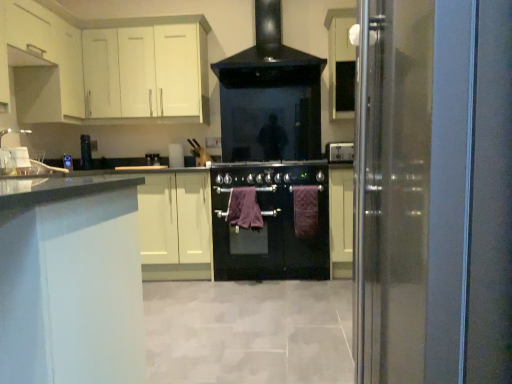
Question: Can you confirm if satin silver power outlet at upper right, acting as the 1th appliance starting from the right, is smaller than white matte cabinet at upper left, which is the second cabinetry in right-to-left order?

Choices:
 (A) no
 (B) yes

Answer: (B)

Question: Are satin silver power outlet at upper right, placed as the 2th appliance when sorted from left to right, and white matte cabinet at upper left, the first cabinetry in the left-to-right sequence, located far from each other?

Choices:
 (A) no
 (B) yes

Answer: (B)

Question: Is satin silver power outlet at upper right, acting as the first appliance starting from the front, next to white matte cabinet at upper left, which is the second cabinetry in back-to-front order?

Choices:
 (A) no
 (B) yes

Answer: (A)

Question: Considering the relative sizes of satin silver power outlet at upper right, acting as the 1th appliance starting from the right, and white matte cabinet at upper left, arranged as the first cabinetry when viewed from the front, in the image provided, is satin silver power outlet at upper right, acting as the 1th appliance starting from the right, wider than white matte cabinet at upper left, arranged as the first cabinetry when viewed from the front,?

Choices:
 (A) yes
 (B) no

Answer: (B)

Question: Is white matte cabinet at upper left, arranged as the first cabinetry when viewed from the front, a part of satin silver power outlet at upper right, acting as the first appliance starting from the front?

Choices:
 (A) no
 (B) yes

Answer: (A)

Question: From the image's perspective, relative to purple fabric towel at center, arranged as the second blanket when viewed from the left, is satin silver power outlet at upper right, placed as the 2th appliance when sorted from left to right, above or below?

Choices:
 (A) below
 (B) above

Answer: (B)

Question: Visually, is satin silver power outlet at upper right, acting as the 1th appliance starting from the right, positioned to the left or to the right of purple fabric towel at center, the first blanket when ordered from right to left?

Choices:
 (A) right
 (B) left

Answer: (A)

Question: Is point (352, 150) positioned closer to the camera than point (316, 205)?

Choices:
 (A) closer
 (B) farther

Answer: (B)

Question: Considering the positions of satin silver power outlet at upper right, acting as the first appliance starting from the front, and purple fabric towel at center, arranged as the second blanket when viewed from the left, in the image, is satin silver power outlet at upper right, acting as the first appliance starting from the front, taller or shorter than purple fabric towel at center, arranged as the second blanket when viewed from the left,?

Choices:
 (A) tall
 (B) short

Answer: (B)

Question: Is white matte cabinet at upper left, acting as the first cabinetry starting from the back, in front of or behind purple cotton towel at center, which is counted as the first blanket, starting from the left, in the image?

Choices:
 (A) behind
 (B) front

Answer: (A)

Question: Considering the positions of point (102, 31) and point (236, 203), is point (102, 31) closer or farther from the camera than point (236, 203)?

Choices:
 (A) closer
 (B) farther

Answer: (B)

Question: Is white matte cabinet at upper left, acting as the first cabinetry starting from the back, bigger or smaller than purple cotton towel at center, which is counted as the first blanket, starting from the left?

Choices:
 (A) small
 (B) big

Answer: (B)

Question: Is white matte cabinet at upper left, acting as the first cabinetry starting from the back, inside the boundaries of purple cotton towel at center, which is counted as the first blanket, starting from the left, or outside?

Choices:
 (A) inside
 (B) outside

Answer: (B)

Question: Considering the positions of purple cotton towel at center, which is counted as the first blanket, starting from the left, and transparent glass door at right in the image, is purple cotton towel at center, which is counted as the first blanket, starting from the left, bigger or smaller than transparent glass door at right?

Choices:
 (A) big
 (B) small

Answer: (B)

Question: Considering the positions of purple cotton towel at center, the second blanket positioned from the right, and transparent glass door at right in the image, is purple cotton towel at center, the second blanket positioned from the right, wider or thinner than transparent glass door at right?

Choices:
 (A) thin
 (B) wide

Answer: (A)